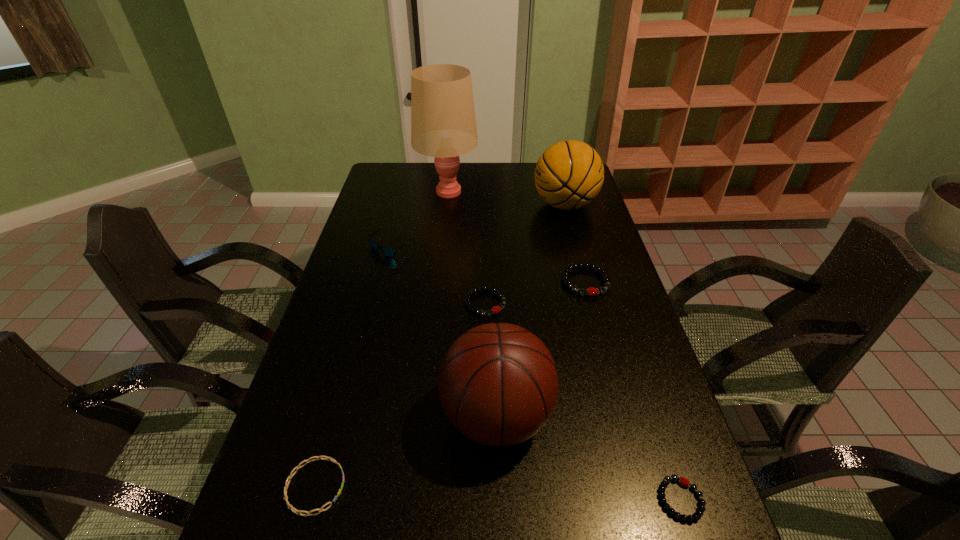
In order to click on blank region between the leftmost black bracelet and the pink lampshade in this screenshot , I will do `click(467, 247)`.

The height and width of the screenshot is (540, 960). In order to click on the sixth closest object relative to the blue bracelet in this screenshot , I will do `click(443, 125)`.

Locate an element on the screen. This screenshot has height=540, width=960. object that is the fifth closest to the sixth nearest object is located at coordinates (591, 291).

Locate which bracelet ranks fourth in proximity to the sunglasses. Please provide its 2D coordinates. Your answer should be formatted as a tuple, i.e. [(x, y)], where the tuple contains the x and y coordinates of a point satisfying the conditions above.

[(698, 513)]

At what (x,y) coordinates should I click in order to perform the action: click on the third closest bracelet relative to the nearest black bracelet. Please return your answer as a coordinate pair (x, y). Looking at the image, I should click on (291, 475).

I want to click on the closest black bracelet to the right basketball, so click(x=591, y=291).

Identify which black bracelet is the second nearest to the third shortest bracelet. Please provide its 2D coordinates. Your answer should be formatted as a tuple, i.e. [(x, y)], where the tuple contains the x and y coordinates of a point satisfying the conditions above.

[(698, 513)]

You are a GUI agent. You are given a task and a screenshot of the screen. Output one action in this format:
    pyautogui.click(x=<x>, y=<y>)
    Task: Click on the free point that satisfies the following two spatial constraints: 1. on the surface of the farther basketball near the brand logo; 2. on the left side of the smallest black bracelet
    The height and width of the screenshot is (540, 960).
    Given the screenshot: What is the action you would take?
    tap(644, 500)

At what (x,y) coordinates should I click in order to perform the action: click on vacant space that satisfies the following two spatial constraints: 1. on the surface of the blue bracelet showing star-shaped elements; 2. on the back side of the smallest black bracelet. Please return your answer as a coordinate pair (x, y). The width and height of the screenshot is (960, 540). Looking at the image, I should click on (312, 500).

Find the location of a particular element. vacant space that satisfies the following two spatial constraints: 1. on the front side of the brown basketball; 2. on the left side of the second tallest bracelet is located at coordinates click(x=488, y=416).